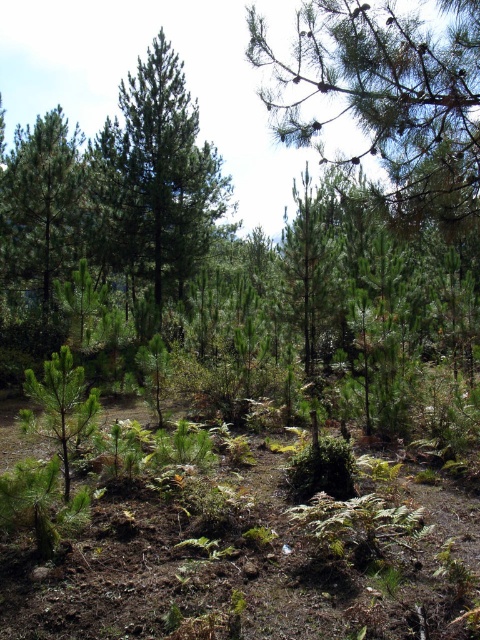
Who is more forward, (x=226, y=188) or (x=60, y=218)?

Point (x=60, y=218) is more forward.

Does point (227, 204) come behind point (57, 156)?

Yes, point (227, 204) is behind point (57, 156).

Who is more distant from viewer, (148, 51) or (26, 150)?

→ Positioned behind is point (148, 51).

This screenshot has height=640, width=480. What are the coordinates of `green matte tree at center` in the screenshot? It's located at (156, 180).